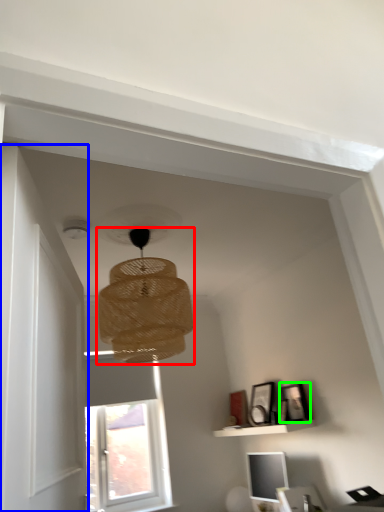
Question: Which object is positioned closest to lamp (highlighted by a red box)? Select from door (highlighted by a blue box) and picture frame (highlighted by a green box).

Choices:
 (A) door
 (B) picture frame

Answer: (A)